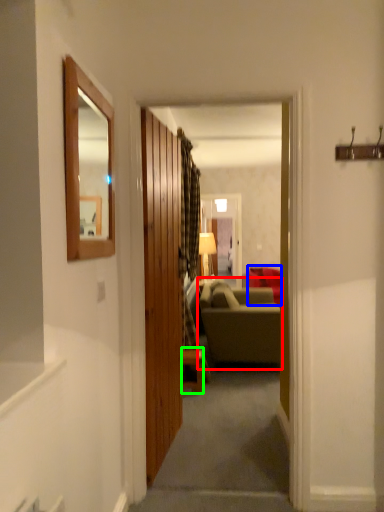
Question: Considering the real-world distances, which object is farthest from studio couch (highlighted by a red box)? studio couch (highlighted by a blue box) or table (highlighted by a green box)?

Choices:
 (A) studio couch
 (B) table

Answer: (A)